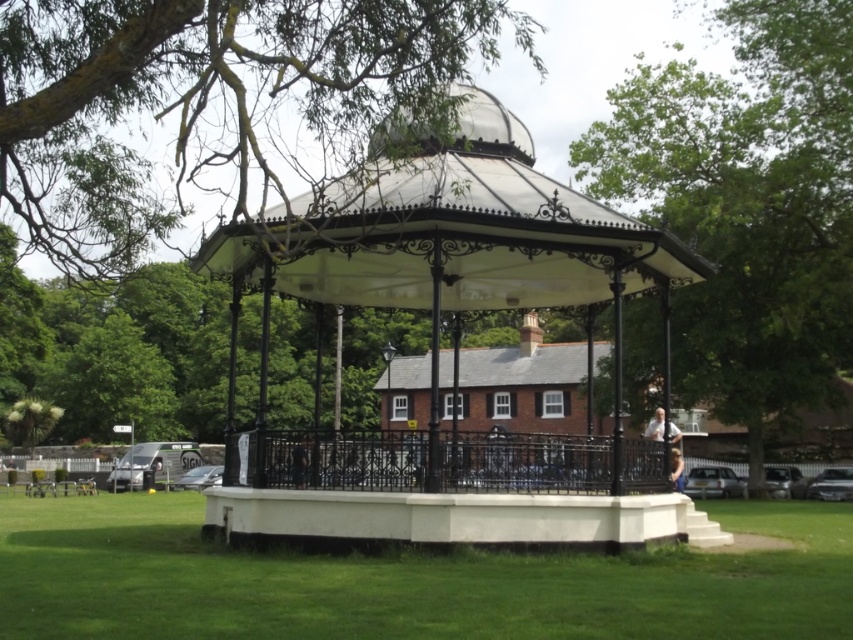
Question: Is green leafy tree at upper left positioned at the back of white stone gazebo at center?

Choices:
 (A) no
 (B) yes

Answer: (B)

Question: Can you confirm if black wrought iron gazebo at center is positioned below green leafy tree at upper center?

Choices:
 (A) yes
 (B) no

Answer: (A)

Question: Among these objects, which one is farthest from the camera?

Choices:
 (A) green leafy tree at upper left
 (B) black wrought iron gazebo at center
 (C) white stone gazebo at center

Answer: (B)

Question: Which object is farther from the camera taking this photo?

Choices:
 (A) green leafy tree at upper left
 (B) black wrought iron gazebo at center

Answer: (B)

Question: Which object is positioned farthest from the green leafy tree at upper center?

Choices:
 (A) white stone gazebo at center
 (B) green leafy tree at upper left
 (C) black wrought iron gazebo at center

Answer: (C)

Question: Can you confirm if black wrought iron gazebo at center is positioned to the right of green leafy tree at upper center?

Choices:
 (A) yes
 (B) no

Answer: (B)